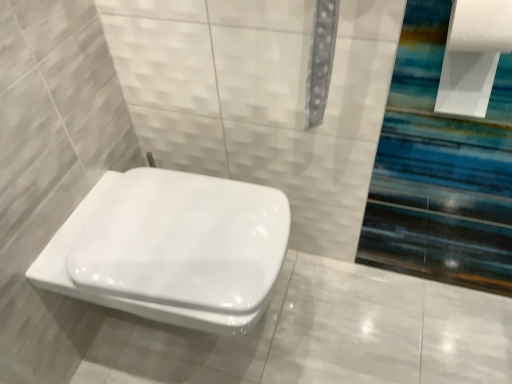
Question: Is white glossy toilet at center in front of or behind white paper at upper right in the image?

Choices:
 (A) behind
 (B) front

Answer: (A)

Question: Is white glossy toilet at center spatially inside white paper at upper right, or outside of it?

Choices:
 (A) inside
 (B) outside

Answer: (B)

Question: From a real-world perspective, is white glossy toilet at center positioned above or below white paper at upper right?

Choices:
 (A) below
 (B) above

Answer: (A)

Question: Is white paper at upper right wider or thinner than white glossy toilet at center?

Choices:
 (A) wide
 (B) thin

Answer: (B)

Question: From the image's perspective, is white paper at upper right positioned above or below white glossy toilet at center?

Choices:
 (A) above
 (B) below

Answer: (A)

Question: In the image, is white paper at upper right positioned in front of or behind white glossy toilet at center?

Choices:
 (A) behind
 (B) front

Answer: (B)

Question: Which is correct: white paper at upper right is inside white glossy toilet at center, or outside of it?

Choices:
 (A) outside
 (B) inside

Answer: (A)